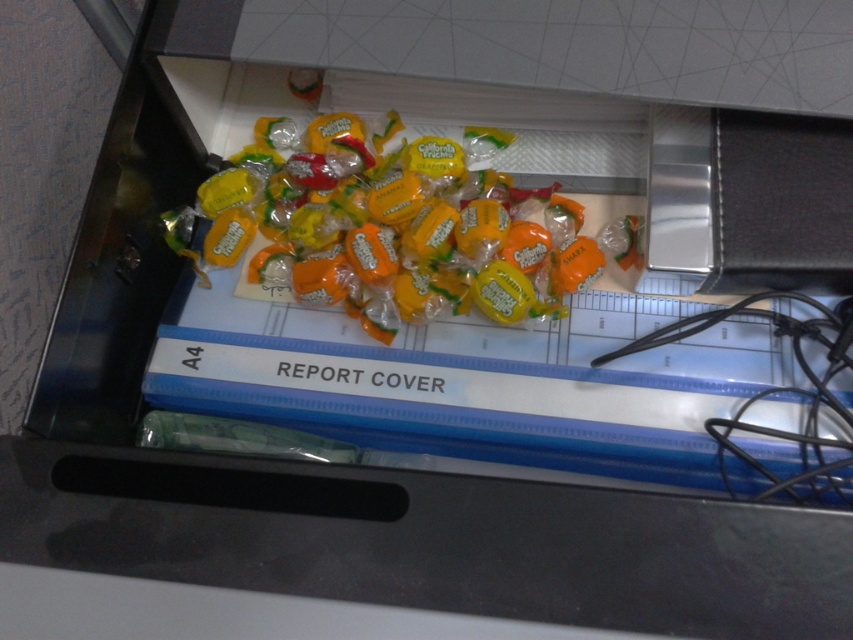
You are trying to reach into the drawer to grab an item. There are two points marked in the drawer, point A at point (611, 241) and point B at point (762, 492). Which point is closer to your hand when you first open the drawer?

Point A at point (611, 241) is closer to your hand when you first open the drawer because it is further to the viewer than point B at point (762, 492).

You are organizing a drawer and need to place a new item between the yellow matte candy at center and the black rubber wire at right. Which item should you place closer to the front of the drawer?

You should place the new item closer to the yellow matte candy at center because it is already positioned closer to the viewer than the black rubber wire at right.